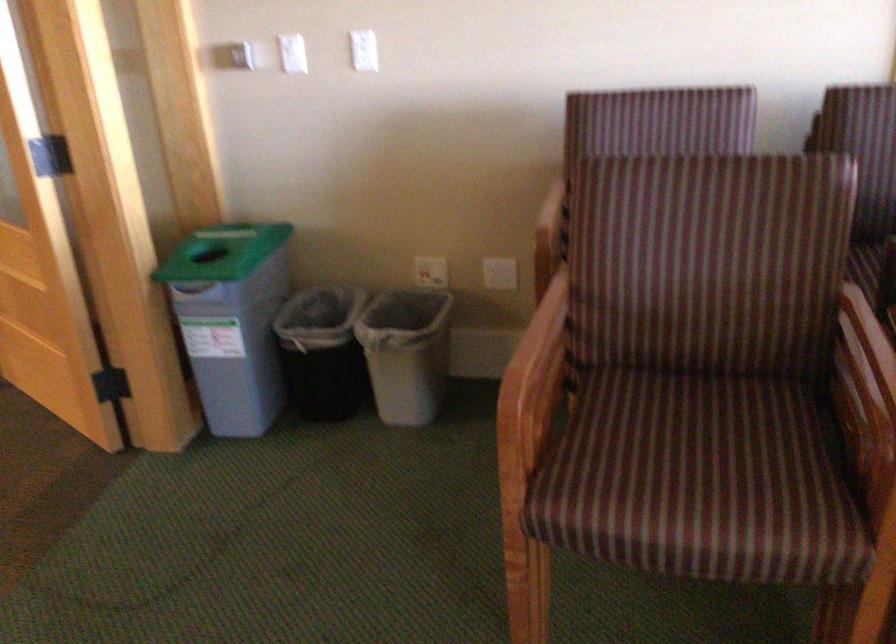
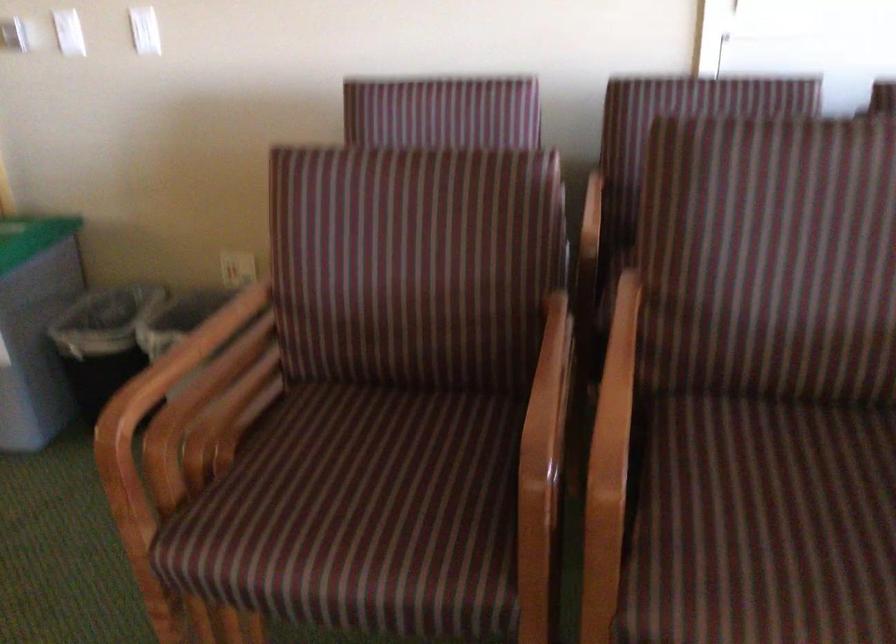
Question: The images are taken continuously from a first-person perspective. In which direction is your viewpoint rotating?

Choices:
 (A) Left
 (B) Right
 (C) Up
 (D) Down

Answer: (B)